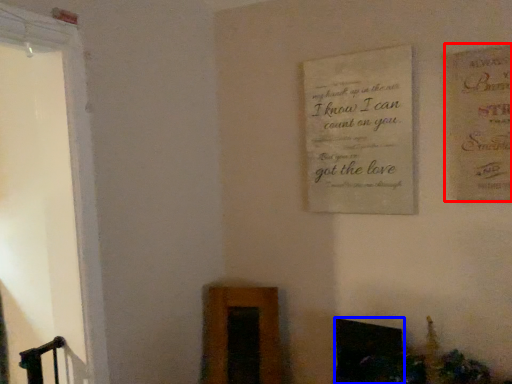
Question: Which object appears farthest to the camera in this image, postcard (highlighted by a red box) or fireplace (highlighted by a blue box)?

Choices:
 (A) postcard
 (B) fireplace

Answer: (B)